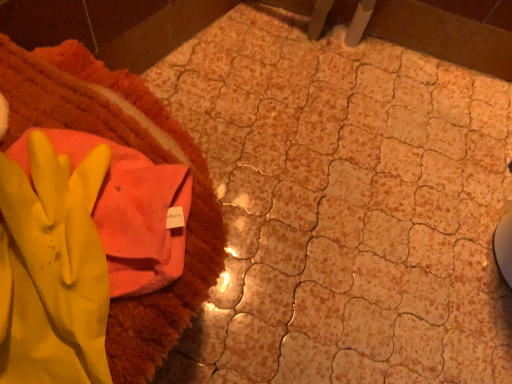
Question: Should I look upward or downward to see orange terry cloth towel at upper left?

Choices:
 (A) up
 (B) down

Answer: (B)

Question: Is orange terry cloth towel at upper left shorter than yellow rubber glove at left?

Choices:
 (A) no
 (B) yes

Answer: (A)

Question: Is yellow rubber glove at left at the back of orange terry cloth towel at upper left?

Choices:
 (A) no
 (B) yes

Answer: (A)

Question: Considering the relative positions of orange terry cloth towel at upper left and yellow rubber glove at left in the image provided, is orange terry cloth towel at upper left behind yellow rubber glove at left?

Choices:
 (A) yes
 (B) no

Answer: (A)

Question: Is orange terry cloth towel at upper left taller than yellow rubber glove at left?

Choices:
 (A) yes
 (B) no

Answer: (A)

Question: From a real-world perspective, is orange terry cloth towel at upper left beneath yellow rubber glove at left?

Choices:
 (A) yes
 (B) no

Answer: (A)

Question: Does orange terry cloth towel at upper left have a larger size compared to yellow rubber glove at left?

Choices:
 (A) no
 (B) yes

Answer: (B)

Question: Does yellow rubber glove at left have a greater width compared to orange terry cloth towel at upper left?

Choices:
 (A) no
 (B) yes

Answer: (A)

Question: Is orange terry cloth towel at upper left located within yellow rubber glove at left?

Choices:
 (A) yes
 (B) no

Answer: (B)

Question: Is yellow rubber glove at left not within orange terry cloth towel at upper left?

Choices:
 (A) no
 (B) yes

Answer: (A)

Question: From a real-world perspective, is yellow rubber glove at left under orange terry cloth towel at upper left?

Choices:
 (A) no
 (B) yes

Answer: (A)

Question: From the image's perspective, is yellow rubber glove at left on orange terry cloth towel at upper left?

Choices:
 (A) no
 (B) yes

Answer: (A)

Question: Is yellow rubber glove at left positioned behind orange terry cloth towel at upper left?

Choices:
 (A) no
 (B) yes

Answer: (A)

Question: In terms of width, does orange terry cloth towel at upper left look wider or thinner when compared to yellow rubber glove at left?

Choices:
 (A) thin
 (B) wide

Answer: (B)